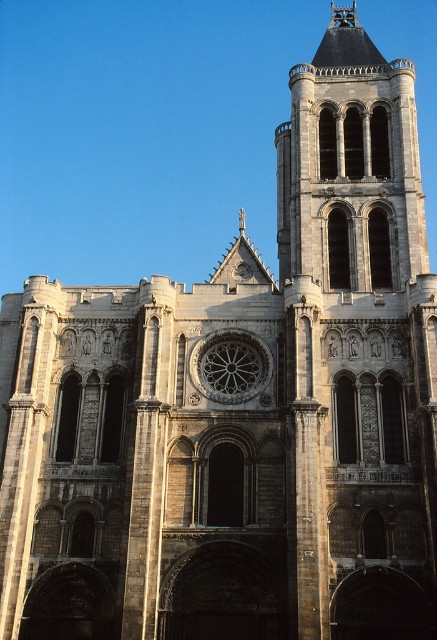
You are an architect planning to install a new stained glass panel. The stone tower at right has a width larger than the stone rose window at center. Which object would require a wider panel to cover its entire width?

The stone tower at right requires a wider panel because its width is larger than the stone rose window at center.

Looking at this image, you are standing in front of the cathedral and want to take a photo of the stone tower at right and the stone rose window at center. Which one is positioned higher up in the image?

The stone tower at right is positioned above the stone rose window at center, so it is higher up in the image.